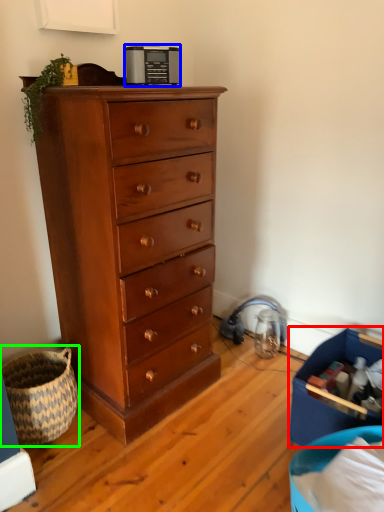
Question: Which object is the farthest from storage box (highlighted by a red box)? Choose among these: appliance (highlighted by a blue box) or basket (highlighted by a green box).

Choices:
 (A) appliance
 (B) basket

Answer: (A)